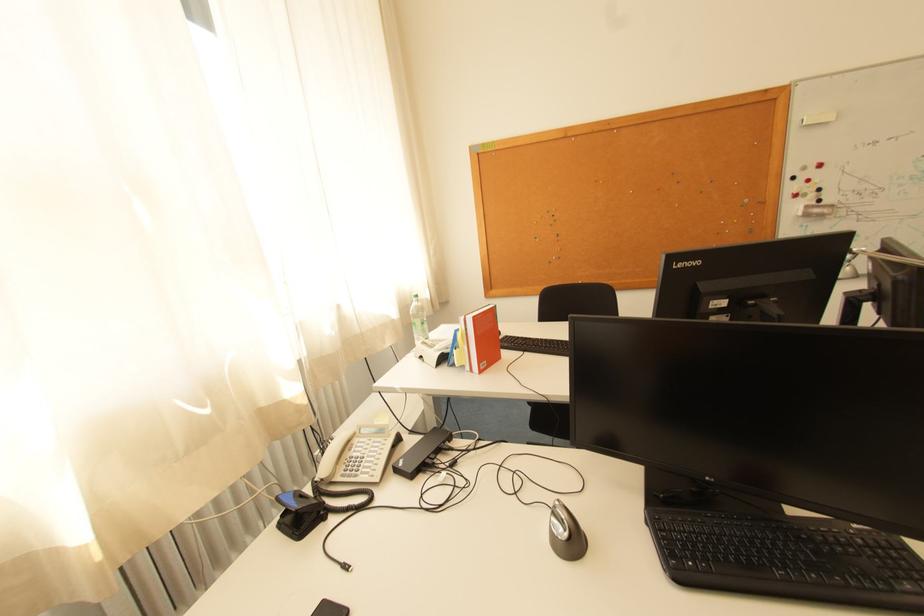
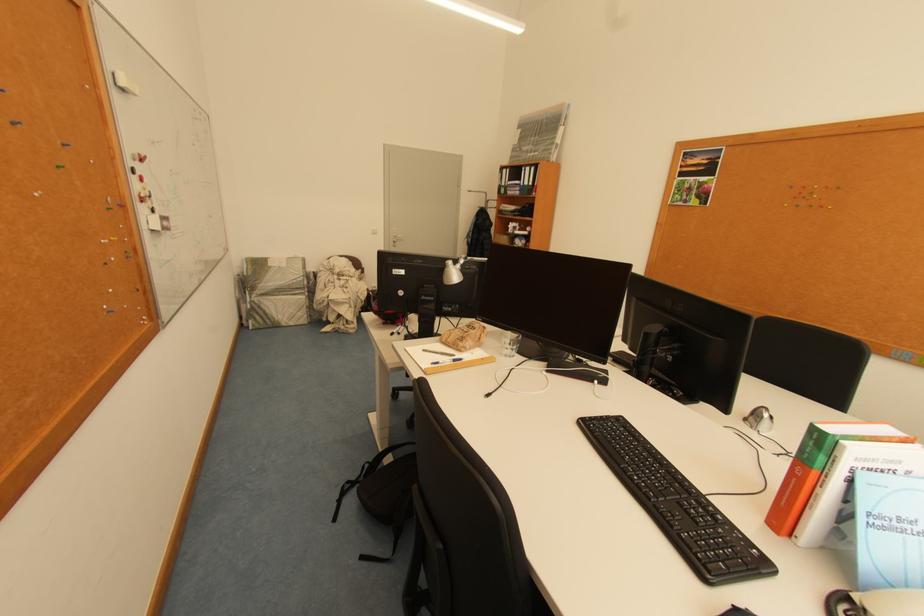
Where in the second image is the point corresponding to (801,180) from the first image?

(141, 172)